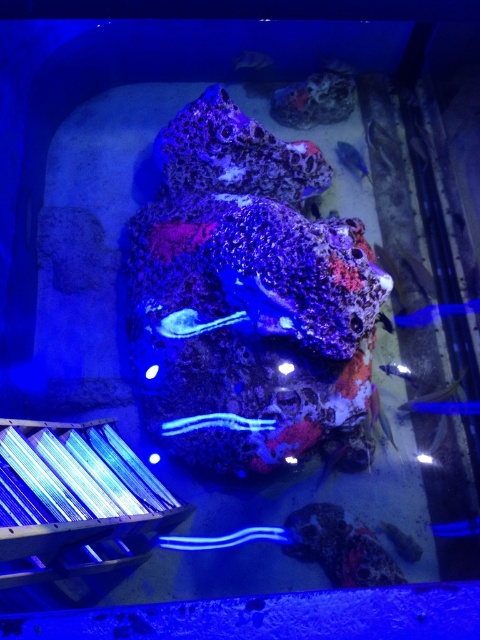
You are an aquarist who needs to place a new decorative item in the aquarium. You have a small statue that is 10 cm tall. The blue glossy fish at right and the translucent glass fish at lower right are already in the aquarium. Which fish should you avoid placing the statue near to prevent blocking their view of the light source?

You should avoid placing the statue near the translucent glass fish at lower right because the blue glossy fish at right is larger in size and may be less affected by the statue blocking their view compared to the smaller translucent glass fish at lower right.

You are an aquatic robot navigating the aquarium. You need to move from the wooden ladder structure to the rock formation. The coordinates of the wooden ladder structure are point (358, 157) and the rock formation is at point (357, 412). Which point is closer to your current position?

Point (358, 157) is your current position, so it is closer to you than point (357, 412).

You are an aquatic explorer navigating through the aquarium. You see the speckled coral at center and the translucent blue worm at center. Which object is located to the right side of the other?

The speckled coral at center is positioned on the right side of translucent blue worm at center.